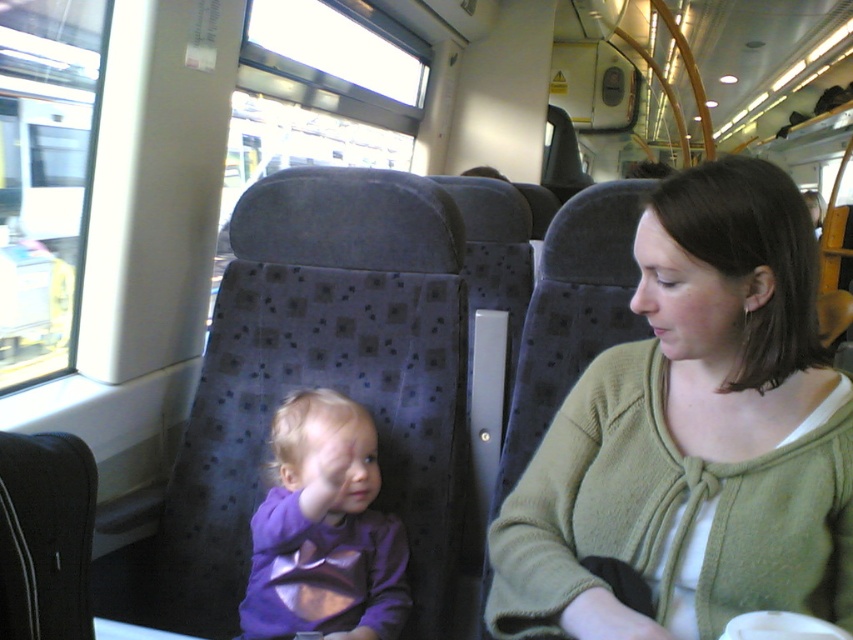
Question: Is green knit cardigan at center wider than purple fabric baby at center?

Choices:
 (A) no
 (B) yes

Answer: (B)

Question: Does green knit cardigan at center have a lesser width compared to purple fabric baby at center?

Choices:
 (A) no
 (B) yes

Answer: (A)

Question: Which object is farther from the camera taking this photo?

Choices:
 (A) green knit cardigan at center
 (B) purple fabric baby at center

Answer: (B)

Question: Is green knit cardigan at center to the left of purple fabric baby at center from the viewer's perspective?

Choices:
 (A) no
 (B) yes

Answer: (A)